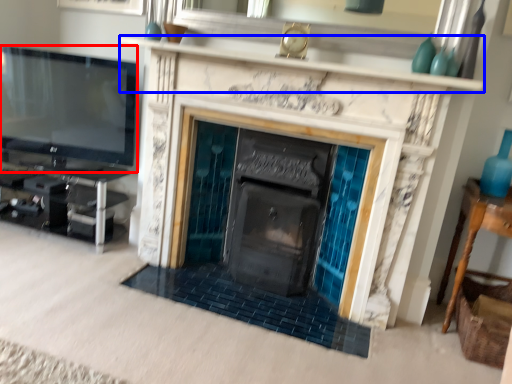
Question: Which of the following is the farthest to the observer, television (highlighted by a red box) or mantle (highlighted by a blue box)?

Choices:
 (A) television
 (B) mantle

Answer: (A)